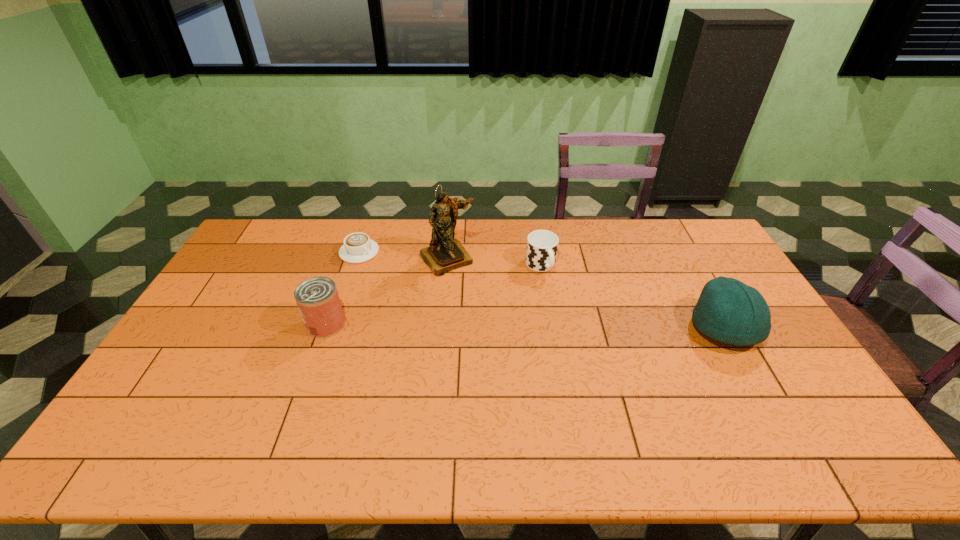
I want to click on free spot that satisfies the following two spatial constraints: 1. on the front side of the shortest object; 2. on the right side of the third object from left to right, so click(x=357, y=259).